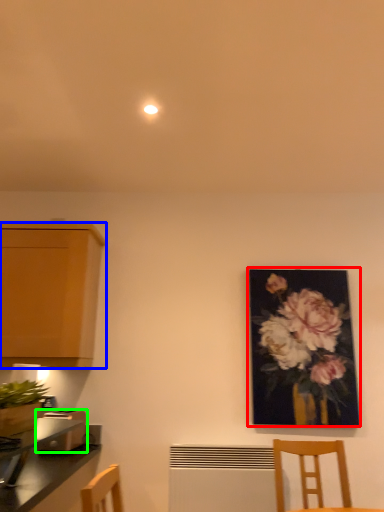
Question: Estimate the real-world distances between objects in this image. Which object is farther from picture frame (highlighted by a red box), cabinetry (highlighted by a blue box) or toaster (highlighted by a green box)?

Choices:
 (A) cabinetry
 (B) toaster

Answer: (B)